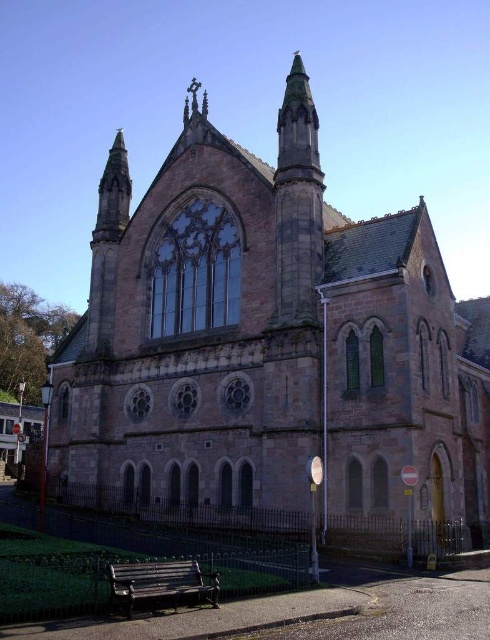
The width and height of the screenshot is (490, 640). What do you see at coordinates (297, 131) in the screenshot?
I see `green stone spire at upper center` at bounding box center [297, 131].

Consider the image. Can you confirm if green stone spire at upper center is positioned to the left of metallic green bench at lower center?

Incorrect, green stone spire at upper center is not on the left side of metallic green bench at lower center.

Is point (290, 140) positioned after point (192, 580)?

That is True.

Image resolution: width=490 pixels, height=640 pixels. Find the location of `green stone spire at upper center`. green stone spire at upper center is located at coordinates (297, 131).